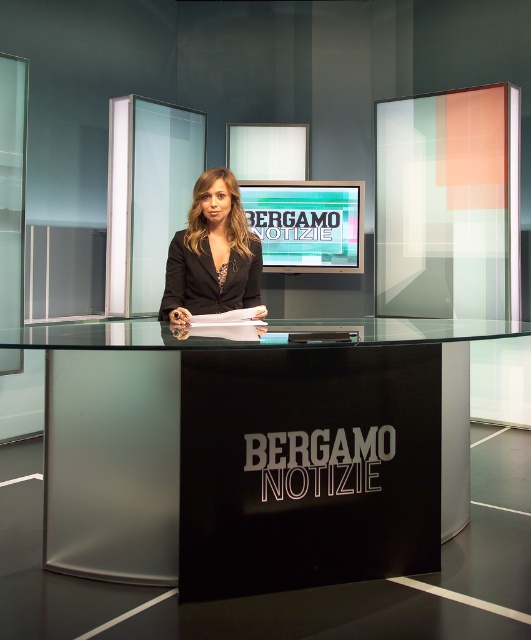
You are a set designer checking the studio layout. You need to ensure that the transparent glass table at center and the matte black blazer at center fit within the studio. The studio has a maximum width of 1.8 meters. Can both items fit side by side without exceeding the width limit?

The transparent glass table at center is wider than the matte black blazer at center. However, since the exact widths are not provided, it is impossible to determine if their combined width exceeds 1.8 meters. Additional measurements are needed.

In the scene shown: You are a guest on the news set and need to sit down. You see the transparent glass table at center and the matte black blazer at center. Which object is positioned to the right of the other?

The transparent glass table at center is to the right of the matte black blazer at center.

You are standing in the news studio and see two points marked on the floor. The first point is at position point (244, 515) and the second is at point (215, 209). If you walk from the first point to the second point, will you be moving towards the news anchor or away from her?

Since point (244, 515) is in front of point (215, 209), moving from the first point to the second point means you are moving away from the news anchor.